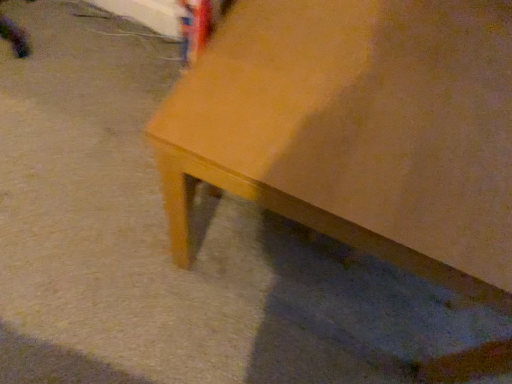
Describe the element at coordinates (357, 130) in the screenshot. Image resolution: width=512 pixels, height=384 pixels. I see `matte wood table at lower right` at that location.

Locate an element on the screen. This screenshot has width=512, height=384. matte wood table at lower right is located at coordinates (357, 130).

Where is `matte wood table at lower right`? The image size is (512, 384). matte wood table at lower right is located at coordinates (357, 130).